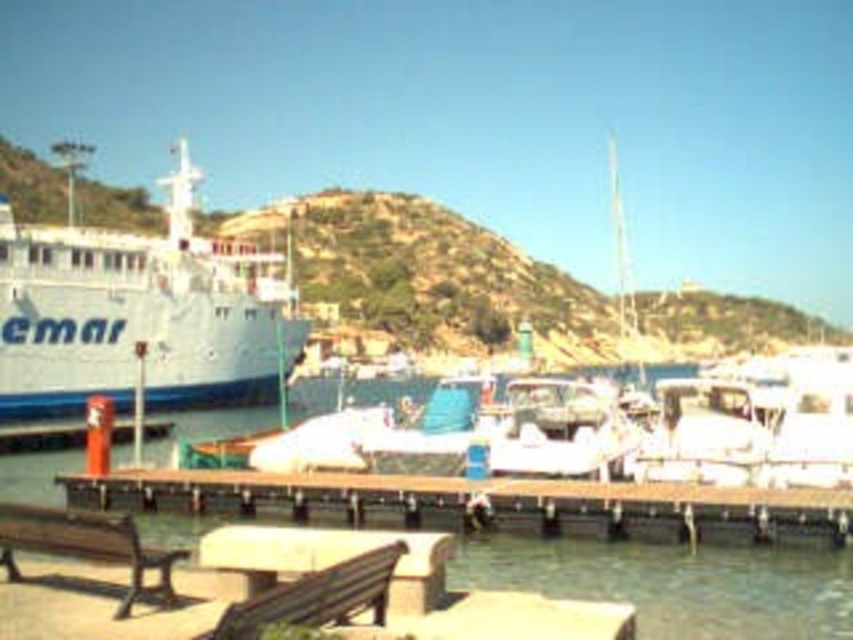
Is white matte cruise ship at left shorter than wooden park bench at lower left?

No, white matte cruise ship at left is not shorter than wooden park bench at lower left.

Does white matte cruise ship at left have a greater width compared to wooden park bench at lower left?

Yes, white matte cruise ship at left is wider than wooden park bench at lower left.

Who is more forward, (206, 248) or (161, 560)?

Point (161, 560)

What are the coordinates of `white matte cruise ship at left` in the screenshot? It's located at (138, 314).

Which is in front, point (720, 541) or point (74, 554)?

Point (74, 554) is more forward.

Is point (578, 536) less distant than point (68, 524)?

No.

This screenshot has height=640, width=853. In order to click on brown wooden dock at lower center in this screenshot , I will do `click(486, 502)`.

Between point (137, 330) and point (836, 528), which one is positioned behind?

Point (137, 330)

Which is more to the right, white matte cruise ship at left or brown wooden dock at lower center?

brown wooden dock at lower center

The image size is (853, 640). What are the coordinates of `white matte cruise ship at left` in the screenshot? It's located at (138, 314).